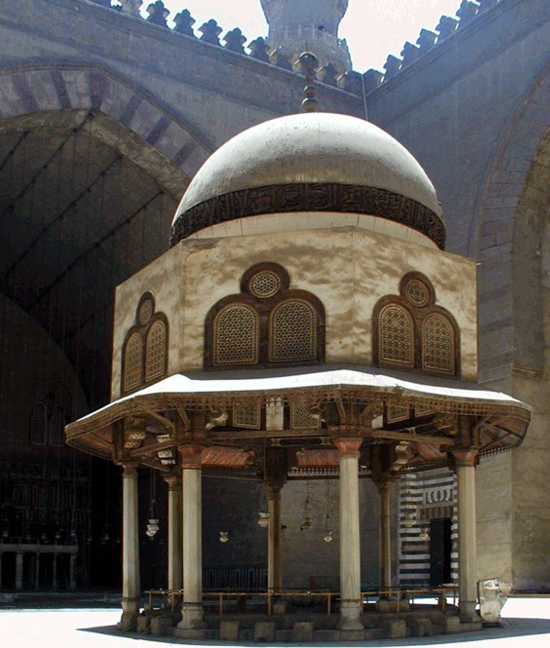
The height and width of the screenshot is (648, 550). Identify the location of dark window. (439, 540).